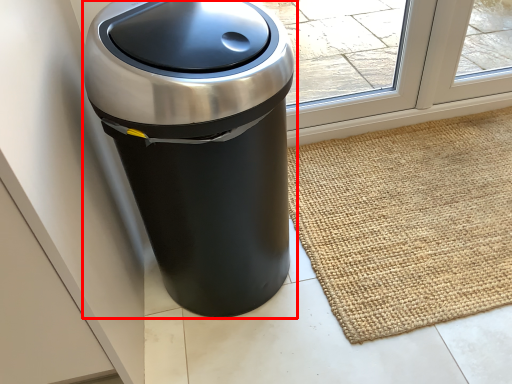
Question: From the image's perspective, where is waste container (annotated by the red box) located in relation to doormat in the image?

Choices:
 (A) above
 (B) below

Answer: (A)